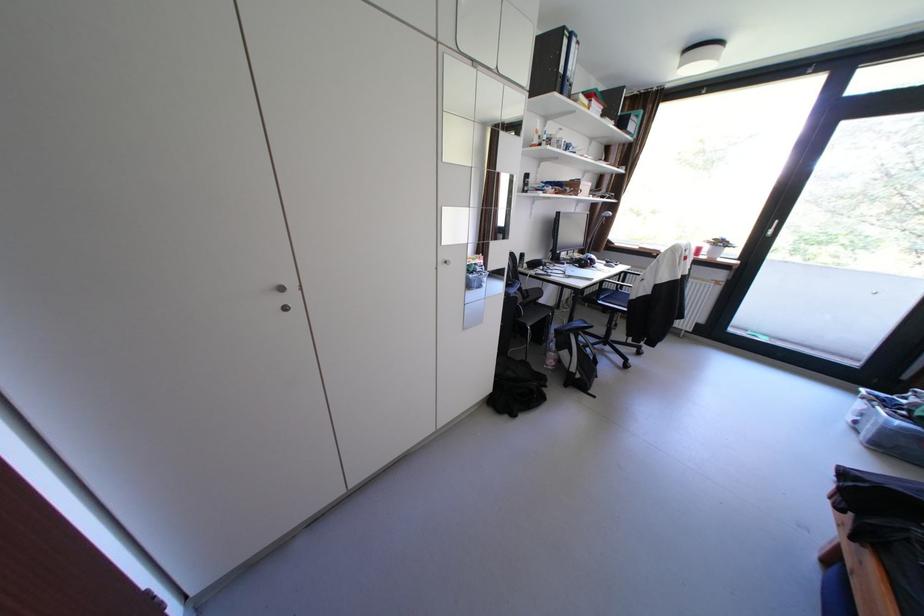
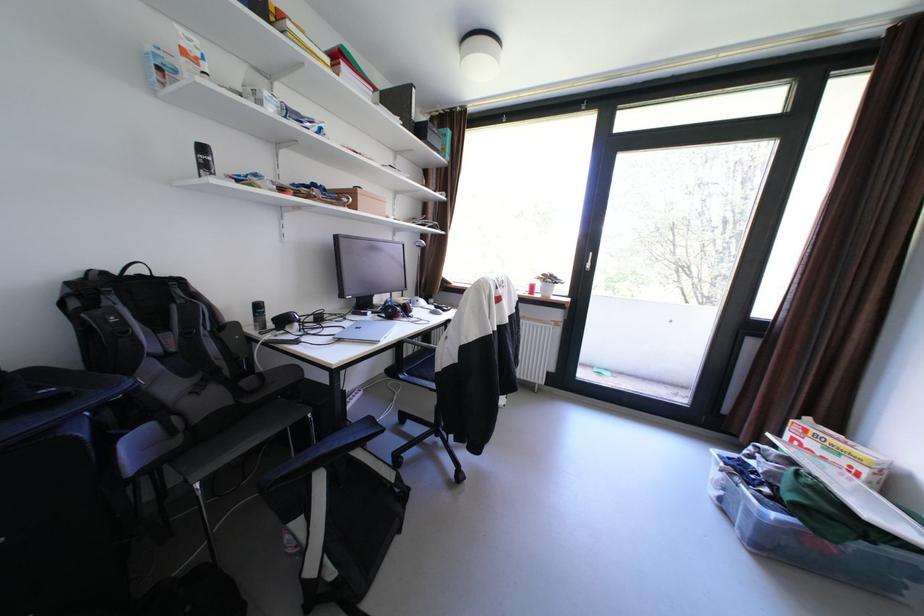
In the scene shown: In a continuous first-person perspective shot, in which direction is the camera moving?

The cameraman walked toward right, forward.